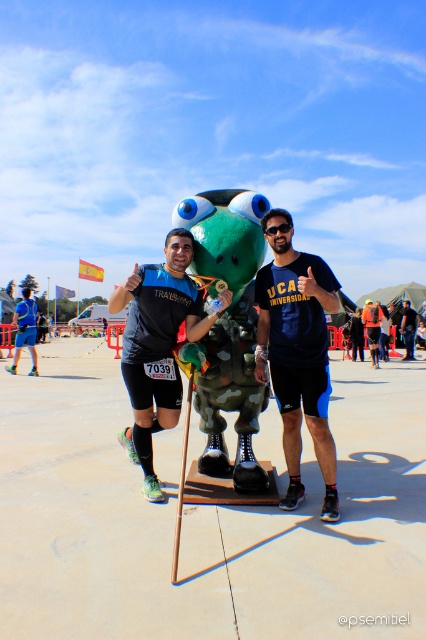
You are a photographer at the event and want to arrange the two runners, the blue matte shirt at center and the black matte shirt at center, side by side for a photo. Based on their sizes, which one should you place on the left to make the composition look balanced?

The blue matte shirt at center is thinner than the black matte shirt at center. To balance the composition, place the thinner blue matte shirt at center on the left and the thicker black matte shirt at center on the right.

You are an event photographer at the sports event. You need to capture a photo of the blue matte shirt at center while avoiding the green frog mascot. Where should you position your camera relative to the point specified at point coordinates (296,352)?

The blue matte shirt at center is located at point coordinates (296,352). To avoid the green frog mascot, position the camera directly at this point to focus on the blue matte shirt at center without obstruction.

You are a photographer at the event and need to capture a photo where both the blue matte shirt at center and the black matte shirt at center are clearly visible. Based on their positions, which shirt should you focus on to ensure both are in the frame?

The blue matte shirt at center is in front of the black matte shirt at center, so focusing on the blue matte shirt at center will keep both in the frame as the black one is behind it.